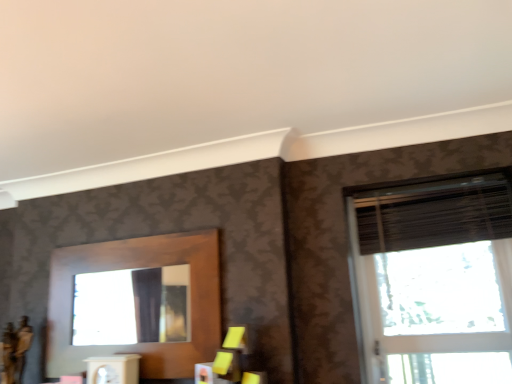
Question: Should I look upward or downward to see black textured blind at upper right?

Choices:
 (A) up
 (B) down

Answer: (B)

Question: Can you confirm if black textured blind at upper right is wider than matte black window at right?

Choices:
 (A) yes
 (B) no

Answer: (A)

Question: From the image's perspective, is black textured blind at upper right over matte black window at right?

Choices:
 (A) no
 (B) yes

Answer: (B)

Question: Is black textured blind at upper right bigger than matte black window at right?

Choices:
 (A) yes
 (B) no

Answer: (B)

Question: Are black textured blind at upper right and matte black window at right beside each other?

Choices:
 (A) no
 (B) yes

Answer: (A)

Question: Could you tell me if black textured blind at upper right is facing matte black window at right?

Choices:
 (A) yes
 (B) no

Answer: (A)

Question: Would you say black textured blind at upper right is outside matte black window at right?

Choices:
 (A) yes
 (B) no

Answer: (B)

Question: Does matte black window at right have a larger size compared to black textured blind at upper right?

Choices:
 (A) no
 (B) yes

Answer: (B)

Question: Would you say matte black window at right contains black textured blind at upper right?

Choices:
 (A) no
 (B) yes

Answer: (B)

Question: From a real-world perspective, is matte black window at right positioned under black textured blind at upper right based on gravity?

Choices:
 (A) yes
 (B) no

Answer: (A)

Question: Is matte black window at right closer to the viewer compared to black textured blind at upper right?

Choices:
 (A) yes
 (B) no

Answer: (A)

Question: Does matte black window at right appear on the right side of black textured blind at upper right?

Choices:
 (A) yes
 (B) no

Answer: (A)

Question: Is matte black window at right at the left side of black textured blind at upper right?

Choices:
 (A) yes
 (B) no

Answer: (B)

Question: Does point (380, 210) appear closer or farther from the camera than point (492, 327)?

Choices:
 (A) farther
 (B) closer

Answer: (A)